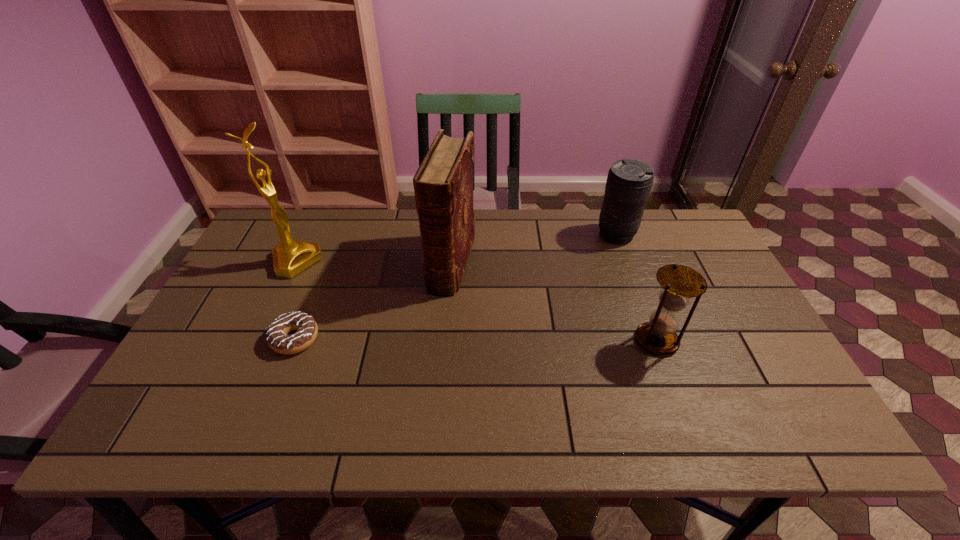
Image resolution: width=960 pixels, height=540 pixels. Find the location of `free spot on the desktop that is between the shortest object and the hourglass and is positioned on the spine side of the third object from right to left`. free spot on the desktop that is between the shortest object and the hourglass and is positioned on the spine side of the third object from right to left is located at coordinates (426, 339).

This screenshot has height=540, width=960. What are the coordinates of `free space on the desktop that is between the shortest object and the hourglass and is positioned on the side of the telephoto lens where the control switches are located` in the screenshot? It's located at (510, 340).

The height and width of the screenshot is (540, 960). What are the coordinates of `vacant space on the desktop that is between the doughnut and the hourglass and is positioned on the front-facing side of the award` in the screenshot? It's located at (439, 339).